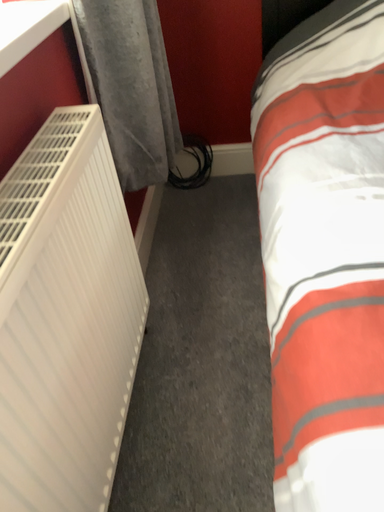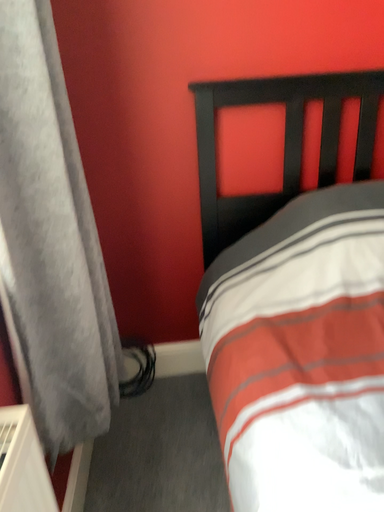
Question: How did the camera likely rotate when shooting the video?

Choices:
 (A) rotated downward
 (B) rotated upward

Answer: (B)